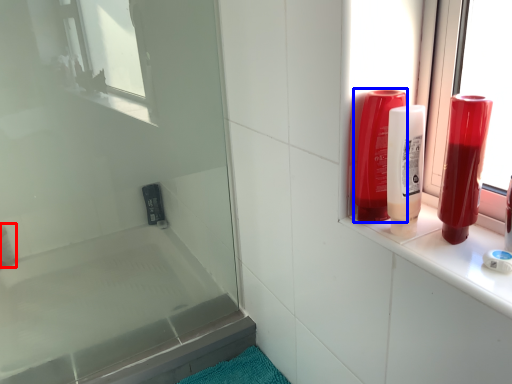
Question: Which point is closer to the camera, toiletry (highlighted by a red box) or mouthwash (highlighted by a blue box)?

Choices:
 (A) toiletry
 (B) mouthwash

Answer: (B)